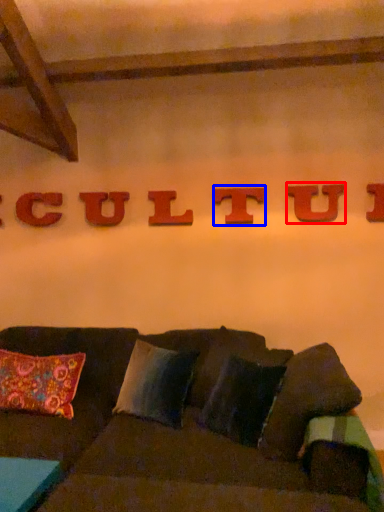
Question: Which of the following is the farthest to the observer, letter (highlighted by a red box) or letter (highlighted by a blue box)?

Choices:
 (A) letter
 (B) letter

Answer: (B)